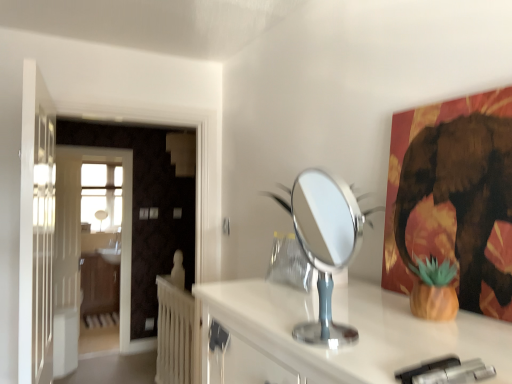
Question: Which is correct: white wooden door at left, the 1th door when ordered from back to front, is inside metallic gold elephant at upper right, or outside of it?

Choices:
 (A) inside
 (B) outside

Answer: (B)

Question: From the image's perspective, is white wooden door at left, the 1th door when ordered from back to front, located above or below metallic gold elephant at upper right?

Choices:
 (A) below
 (B) above

Answer: (A)

Question: Based on their relative distances, which object is farther from the white wooden door at left, which is the second door from back to front?

Choices:
 (A) white glossy sink at center
 (B) metallic gold elephant at upper right
 (C) wooden dresser at left
 (D) silver metallic mirror at center
 (E) white wooden door at left, which ranks as the second door in right-to-left order

Answer: (B)

Question: Which object is the farthest from the white glossy sink at center?

Choices:
 (A) wooden dresser at left
 (B) white wooden door at left, the 1th door when ordered from back to front
 (C) silver metallic mirror at center
 (D) white wooden door at left, acting as the first door starting from the front
 (E) metallic gold elephant at upper right

Answer: (E)